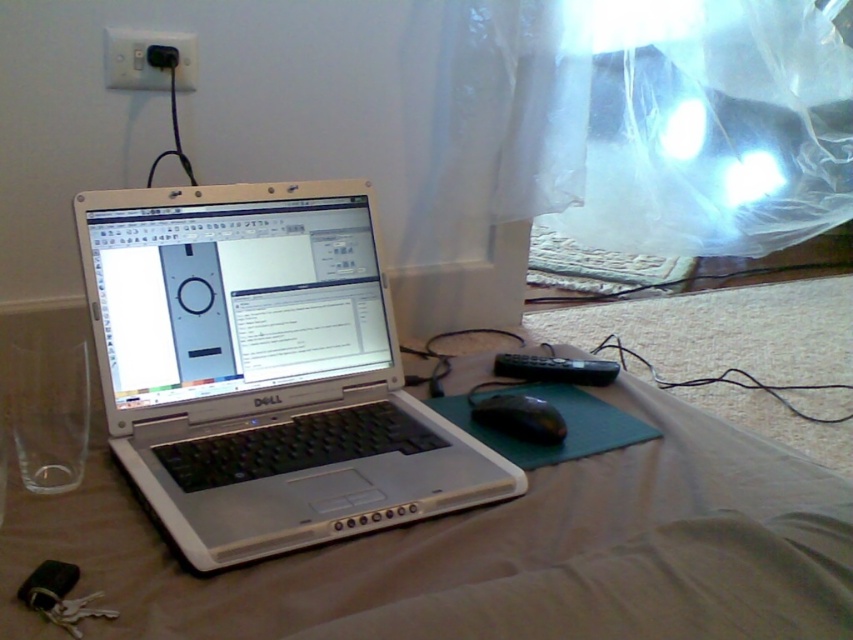
Question: Where is black plastic plug at upper left located in relation to black plastic mouse at lower center in the image?

Choices:
 (A) above
 (B) below

Answer: (A)

Question: Is black plastic plug at upper left smaller than black plastic mouse at lower center?

Choices:
 (A) yes
 (B) no

Answer: (A)

Question: Estimate the real-world distances between objects in this image. Which object is farther from the black plastic mouse at lower center?

Choices:
 (A) silver metallic laptop at center
 (B) black plastic plug at upper left

Answer: (B)

Question: Does black plastic plug at upper left appear on the left side of black plastic mouse at lower center?

Choices:
 (A) yes
 (B) no

Answer: (A)

Question: Considering the real-world distances, which object is closest to the silver metallic laptop at center?

Choices:
 (A) black plastic plug at upper left
 (B) black plastic mouse at lower center

Answer: (B)

Question: Which is farther from the black plastic plug at upper left?

Choices:
 (A) black plastic mouse at lower center
 (B) silver metallic laptop at center

Answer: (A)